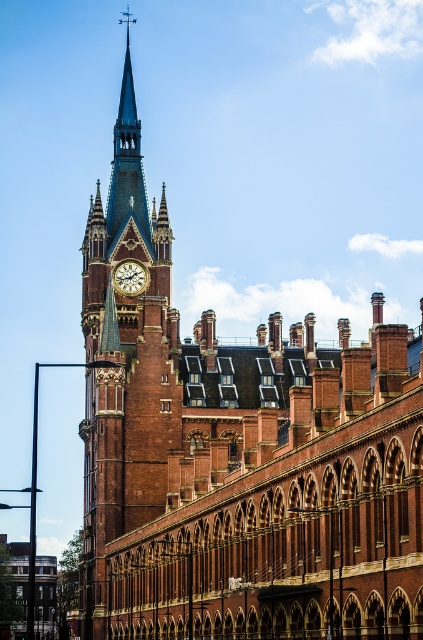
Does polished copper spire at upper left have a greater height compared to gold metallic clock at upper center?

Yes, polished copper spire at upper left is taller than gold metallic clock at upper center.

Which is in front, point (137, 182) or point (115, 278)?

Positioned in front is point (115, 278).

Between point (147, 196) and point (131, 260), which one is positioned behind?

The point (147, 196) is behind.

Image resolution: width=423 pixels, height=640 pixels. Identify the location of polished copper spire at upper left. (126, 161).